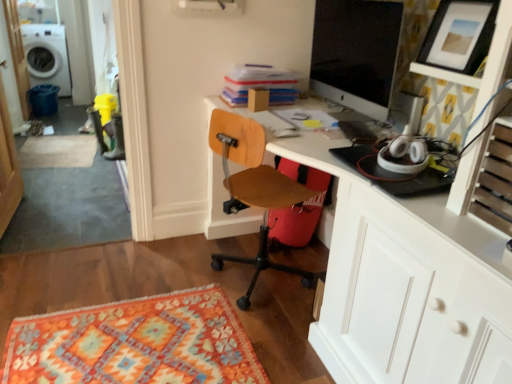
The width and height of the screenshot is (512, 384). What do you see at coordinates (47, 56) in the screenshot?
I see `white glossy washing machine at upper left` at bounding box center [47, 56].

In the scene shown: Measure the distance between transparent glass door at left, the 2th glass door when ordered from left to right, and camera.

transparent glass door at left, the 2th glass door when ordered from left to right, and camera are 2.37 meters apart from each other.

The width and height of the screenshot is (512, 384). Describe the element at coordinates (8, 166) in the screenshot. I see `transparent glass door at left, which is the 2th glass door from back to front` at that location.

Image resolution: width=512 pixels, height=384 pixels. Find the location of `beige carpet at lower left, positioned as the 1th mat in top-to-bottom order`. beige carpet at lower left, positioned as the 1th mat in top-to-bottom order is located at coordinates (58, 151).

At what (x,y) coordinates should I click in order to perform the action: click on woodenchair at center. Please return your answer as a coordinate pair (x, y). Looking at the image, I should click on (x=254, y=190).

From the image's perspective, which one is positioned higher, transparent glass door at left, the 2th glass door when ordered from left to right, or textured woolen rug at lower left, which appears as the 2th mat when viewed from the left?

transparent glass door at left, the 2th glass door when ordered from left to right, from the image's perspective.

Which point is more forward, (18,186) or (59,373)?

The point (59,373) is closer to the camera.

Considering the positions of objects transparent glass door at left, which is the first glass door in right-to-left order, and textured woolen rug at lower left, which is counted as the second mat, starting from the back, in the image provided, who is in front, transparent glass door at left, which is the first glass door in right-to-left order, or textured woolen rug at lower left, which is counted as the second mat, starting from the back,?

textured woolen rug at lower left, which is counted as the second mat, starting from the back, is closer to the camera.

Is transparent glass door at left, the 2th glass door when ordered from left to right, next to textured woolen rug at lower left, the 2th mat viewed from the top, and touching it?

They are not placed beside each other.

Is point (40, 31) positioned after point (453, 229)?

Yes, point (40, 31) is farther from viewer.

Can you tell me how much white glossy washing machine at upper left and white glossy desk at upper center differ in facing direction?

They differ by 91.1 degrees in their facing directions.

Which of these two, white glossy washing machine at upper left or white glossy desk at upper center, stands taller?

white glossy desk at upper center.

This screenshot has height=384, width=512. Find the location of `washing machine located on the left of white glossy desk at upper center`. washing machine located on the left of white glossy desk at upper center is located at coordinates (47, 56).

From the image's perspective, is transparent glass door at upper left, marked as the 1th glass door in a left-to-right arrangement, positioned above or below transparent glass door at left, which is the 2th glass door from back to front?

Clearly, from the image's perspective, transparent glass door at upper left, marked as the 1th glass door in a left-to-right arrangement, is above transparent glass door at left, which is the 2th glass door from back to front.

Which of these two, transparent glass door at upper left, positioned as the 1th glass door in top-to-bottom order, or transparent glass door at left, which is the 1th glass door in front-to-back order, stands taller?

With more height is transparent glass door at left, which is the 1th glass door in front-to-back order.

Is transparent glass door at upper left, arranged as the second glass door when viewed from the front, touching transparent glass door at left, the 2th glass door when ordered from left to right?

No.

Considering the points (13, 52) and (1, 92), which point is in front, point (13, 52) or point (1, 92)?

The point (1, 92) is closer to the camera.

Between white glossy desk at upper center and matte black picture frame at upper right, which one has more height?

white glossy desk at upper center is taller.

Is white glossy desk at upper center to the left or to the right of matte black picture frame at upper right in the image?

Clearly, white glossy desk at upper center is on the left of matte black picture frame at upper right in the image.

Does white glossy desk at upper center lie behind matte black picture frame at upper right?

That is False.

Based on the photo, considering the relative sizes of white glossy desk at upper center and matte black picture frame at upper right in the image provided, is white glossy desk at upper center thinner than matte black picture frame at upper right?

In fact, white glossy desk at upper center might be wider than matte black picture frame at upper right.

Considering the positions of point (456, 2) and point (69, 94), is point (456, 2) closer or farther from the camera than point (69, 94)?

Clearly, point (456, 2) is closer to the camera than point (69, 94).

Could you tell me if matte black picture frame at upper right is turned towards white glossy washing machine at upper left?

No, matte black picture frame at upper right is not turned towards white glossy washing machine at upper left.

In the scene shown: How distant is matte black picture frame at upper right from white glossy washing machine at upper left?

The distance of matte black picture frame at upper right from white glossy washing machine at upper left is 4.29 meters.

Can you tell me how much matte black picture frame at upper right and white glossy washing machine at upper left differ in facing direction?

90.6 degrees separate the facing orientations of matte black picture frame at upper right and white glossy washing machine at upper left.

Is matte black picture frame at upper right next to matte black monitor at upper right?

No, matte black picture frame at upper right is not next to matte black monitor at upper right.

Measure the distance from matte black picture frame at upper right to matte black monitor at upper right.

11.46 inches.

In order to click on picture frame that is on the right side of matte black monitor at upper right in this screenshot , I will do `click(459, 35)`.

Is matte black picture frame at upper right not inside matte black monitor at upper right?

That's correct, matte black picture frame at upper right is outside of matte black monitor at upper right.

From the picture: Is the position of transparent glass door at upper left, acting as the second glass door starting from the bottom, less distant than that of white glossy washing machine at upper left?

Yes, the depth of transparent glass door at upper left, acting as the second glass door starting from the bottom, is less than that of white glossy washing machine at upper left.

Is transparent glass door at upper left, positioned as the 2th glass door in right-to-left order, bigger than white glossy washing machine at upper left?

Incorrect, transparent glass door at upper left, positioned as the 2th glass door in right-to-left order, is not larger than white glossy washing machine at upper left.

Between transparent glass door at upper left, positioned as the 1th glass door in top-to-bottom order, and white glossy washing machine at upper left, which one appears on the left side from the viewer's perspective?

white glossy washing machine at upper left is more to the left.

From a real-world perspective, is transparent glass door at upper left, marked as the 1th glass door in a left-to-right arrangement, below white glossy washing machine at upper left?

Actually, transparent glass door at upper left, marked as the 1th glass door in a left-to-right arrangement, is physically above white glossy washing machine at upper left in the real world.

From a real-world perspective, which mat is the 1st one underneath the transparent glass door at left, which is the 1th glass door in front-to-back order? Please provide its 2D coordinates.

[(135, 343)]

The width and height of the screenshot is (512, 384). I want to click on desk in front of the white glossy washing machine at upper left, so click(407, 284).

Consider the image. Based on their spatial positions, is matte black picture frame at upper right or wooden drawer at right further from textured woolen rug at lower left, the 2th mat viewed from the top?

matte black picture frame at upper right is further to textured woolen rug at lower left, the 2th mat viewed from the top.

Based on the photo, from the image, which object appears to be nearer to textured woolen rug at lower left, which appears as the 2th mat when viewed from the left, matte black picture frame at upper right or woodenchair at center?

woodenchair at center lies closer to textured woolen rug at lower left, which appears as the 2th mat when viewed from the left, than the other object.

From the image, which object appears to be farther from textured woolen rug at lower left, which is counted as the second mat, starting from the back, matte black monitor at upper right or beige carpet at lower left, positioned as the 1th mat in top-to-bottom order?

The object further to textured woolen rug at lower left, which is counted as the second mat, starting from the back, is beige carpet at lower left, positioned as the 1th mat in top-to-bottom order.

Which object lies nearer to the anchor point textured woolen rug at lower left, the 1th mat in the right-to-left sequence, transparent glass door at left, arranged as the 1th glass door when ordered from the bottom, or matte black picture frame at upper right?

transparent glass door at left, arranged as the 1th glass door when ordered from the bottom.

Which object lies further to the anchor point beige carpet at lower left, which ranks as the first mat in back-to-front order, textured woolen rug at lower left, the 1th mat in the bottom-to-top sequence, or woodenchair at center?

woodenchair at center lies further to beige carpet at lower left, which ranks as the first mat in back-to-front order, than the other object.

From the picture: Looking at the image, which one is located further to matte black picture frame at upper right, textured woolen rug at lower left, which is the 1th mat in front-to-back order, or transparent glass door at upper left, acting as the second glass door starting from the bottom?

transparent glass door at upper left, acting as the second glass door starting from the bottom, lies further to matte black picture frame at upper right than the other object.

From the image, which object appears to be nearer to white glossy desk at upper center, woodenchair at center or transparent glass door at upper left, placed as the 1th glass door when sorted from back to front?

woodenchair at center is closer to white glossy desk at upper center.

Estimate the real-world distances between objects in this image. Which object is further from white glossy washing machine at upper left, white glossy desk at upper center or beige carpet at lower left, acting as the second mat starting from the right?

Among the two, white glossy desk at upper center is located further to white glossy washing machine at upper left.

Find the location of `chair between beige carpet at lower left, marked as the 1th mat in a left-to-right arrangement, and wooden drawer at right`. chair between beige carpet at lower left, marked as the 1th mat in a left-to-right arrangement, and wooden drawer at right is located at coordinates (254, 190).

The image size is (512, 384). What are the coordinates of `picture frame between matte black monitor at upper right and textured woolen rug at lower left, the 2th mat viewed from the top, vertically` in the screenshot? It's located at (459, 35).

This screenshot has height=384, width=512. Find the location of `chair between transparent glass door at left, which is the 1th glass door in front-to-back order, and matte black monitor at upper right from left to right`. chair between transparent glass door at left, which is the 1th glass door in front-to-back order, and matte black monitor at upper right from left to right is located at coordinates (254, 190).

Where is `mat located between beige carpet at lower left, placed as the second mat when sorted from front to back, and matte black picture frame at upper right in the left-right direction`? This screenshot has width=512, height=384. mat located between beige carpet at lower left, placed as the second mat when sorted from front to back, and matte black picture frame at upper right in the left-right direction is located at coordinates (135, 343).